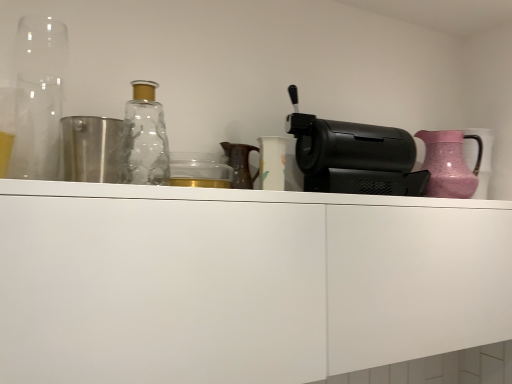
Question: Can you confirm if black plastic coffee machine at right is taller than transparent glass bottle at upper left?

Choices:
 (A) no
 (B) yes

Answer: (A)

Question: Is transparent glass bottle at upper left at the back of black plastic coffee machine at right?

Choices:
 (A) yes
 (B) no

Answer: (B)

Question: From a real-world perspective, is black plastic coffee machine at right on transparent glass bottle at upper left?

Choices:
 (A) no
 (B) yes

Answer: (B)

Question: From the image's perspective, is black plastic coffee machine at right located beneath transparent glass bottle at upper left?

Choices:
 (A) no
 (B) yes

Answer: (B)

Question: Is black plastic coffee machine at right positioned far away from transparent glass bottle at upper left?

Choices:
 (A) yes
 (B) no

Answer: (B)

Question: From a real-world perspective, does black plastic coffee machine at right sit lower than transparent glass bottle at upper left?

Choices:
 (A) no
 (B) yes

Answer: (A)

Question: Is transparent glass at left behind black plastic coffee machine at right?

Choices:
 (A) yes
 (B) no

Answer: (B)

Question: Is transparent glass at left shorter than black plastic coffee machine at right?

Choices:
 (A) yes
 (B) no

Answer: (B)

Question: From the image's perspective, is transparent glass at left under black plastic coffee machine at right?

Choices:
 (A) yes
 (B) no

Answer: (B)

Question: Could black plastic coffee machine at right be considered to be inside transparent glass at left?

Choices:
 (A) no
 (B) yes

Answer: (A)

Question: Considering the relative positions of transparent glass at left and black plastic coffee machine at right in the image provided, is transparent glass at left to the right of black plastic coffee machine at right from the viewer's perspective?

Choices:
 (A) yes
 (B) no

Answer: (B)

Question: Does transparent glass at left have a lesser width compared to black plastic coffee machine at right?

Choices:
 (A) yes
 (B) no

Answer: (B)

Question: Does pink textured jug at right have a smaller size compared to black plastic coffee machine at right?

Choices:
 (A) no
 (B) yes

Answer: (B)